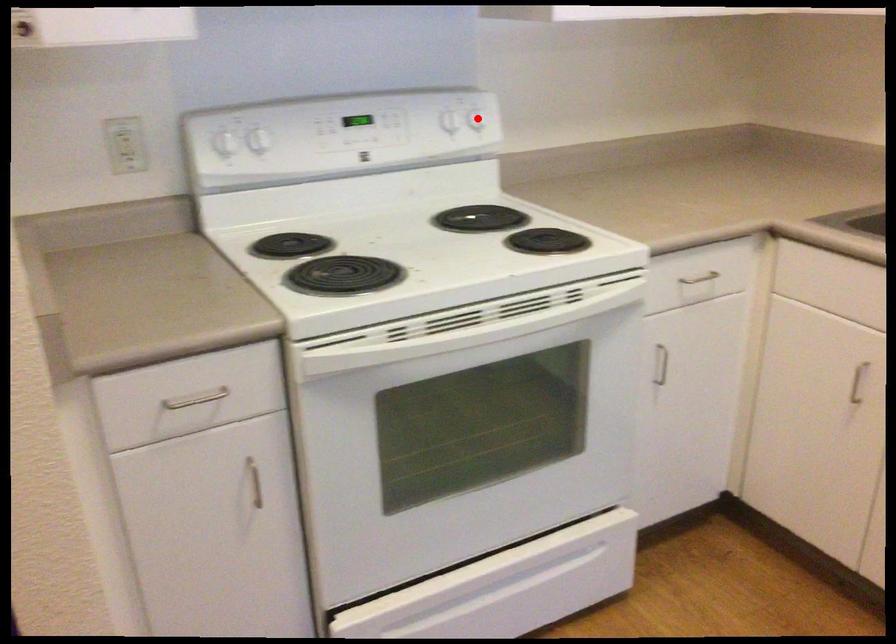
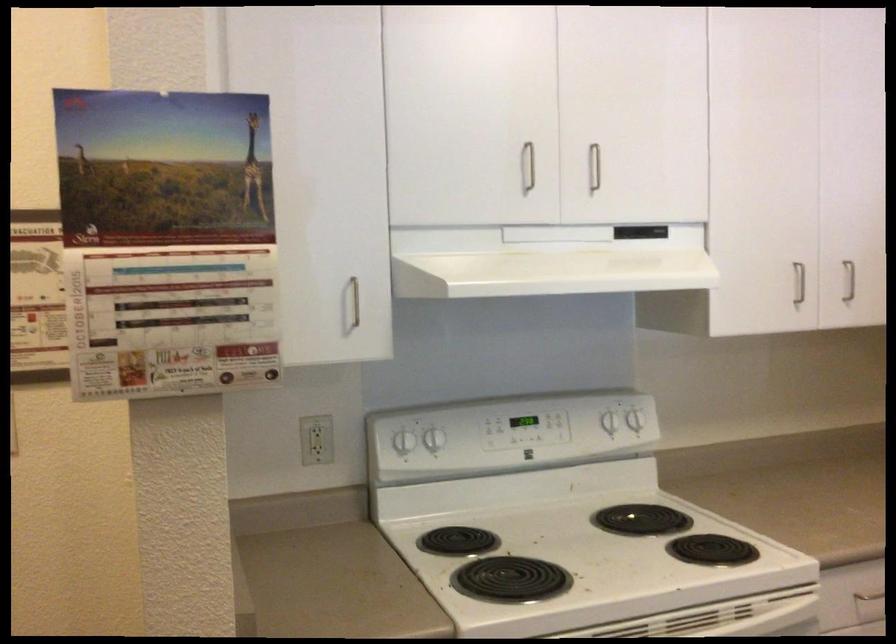
Where in the second image is the point corresponding to the highlighted location from the first image?

(634, 420)